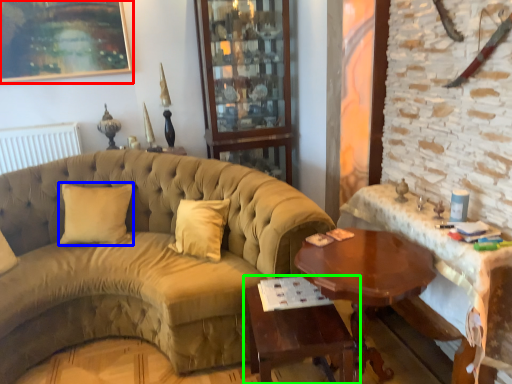
Question: Which object is the closest to the picture frame (highlighted by a red box)? Choose among these: pillow (highlighted by a blue box) or table (highlighted by a green box).

Choices:
 (A) pillow
 (B) table

Answer: (A)